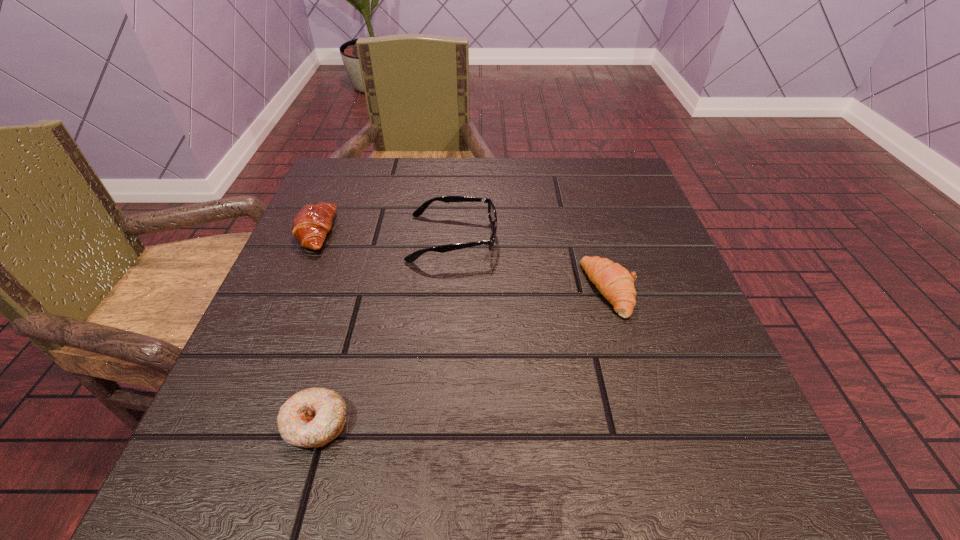
What are the coordinates of `vacant area situated 0.190m on the back of the shortest object` in the screenshot? It's located at (351, 300).

This screenshot has height=540, width=960. Identify the location of spectacles that is positioned at the far edge. (492, 214).

Identify the location of crescent roll present at the far edge. 311,224.

What are the coordinates of `object that is at the near edge` in the screenshot? It's located at (311, 418).

Locate an element on the screen. crescent roll positioned at the left edge is located at coordinates coord(311,224).

I want to click on doughnut that is at the left edge, so click(311, 418).

You are a GUI agent. You are given a task and a screenshot of the screen. Output one action in this format:
    pyautogui.click(x=<x>, y=<y>)
    Task: Click on the object that is positioned at the right edge
    
    Given the screenshot: What is the action you would take?
    pyautogui.click(x=614, y=282)

Locate an element on the screen. The image size is (960, 540). object that is at the far left corner is located at coordinates (311, 224).

Locate an element on the screen. This screenshot has width=960, height=540. object at the near left corner is located at coordinates (311, 418).

Where is `vacant region at the far edge of the desktop`? vacant region at the far edge of the desktop is located at coordinates 466,202.